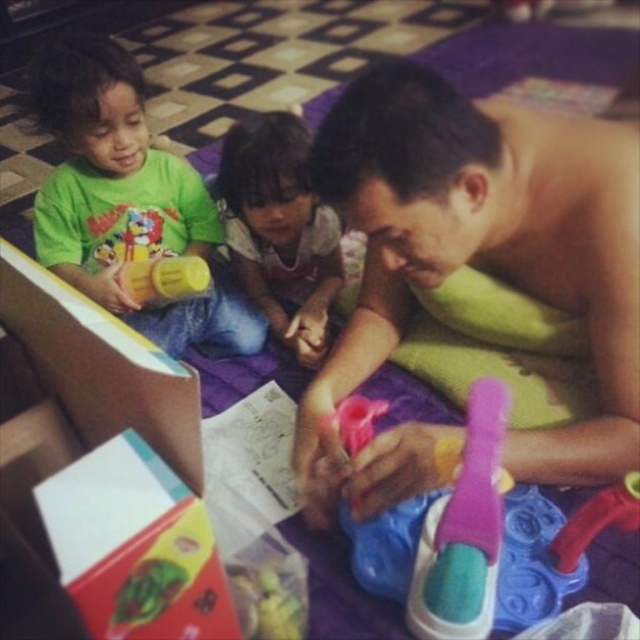
You are a parent standing in the living room. You see the pink plastic brush at center. Can you easily reach it without moving any furniture?

The pink plastic brush at center is 31.64 inches away from you, so you can easily reach it without moving any furniture.

You are a parent trying to organize toys in a storage box that can only hold items up to 10 inches tall. You have the pink plastic brush at center and the pink plastic toy at center. Which item is more likely to fit in the storage box?

The pink plastic brush at center is much taller than the pink plastic toy at center, so the pink plastic toy at center is more likely to fit in the storage box.

Based on the photo, you are organizing a toy box and need to place the pink plastic brush at center and the matte green box at lower left side by side. Which object requires more horizontal space?

The pink plastic brush at center requires more horizontal space because its width surpasses that of the matte green box at lower left.